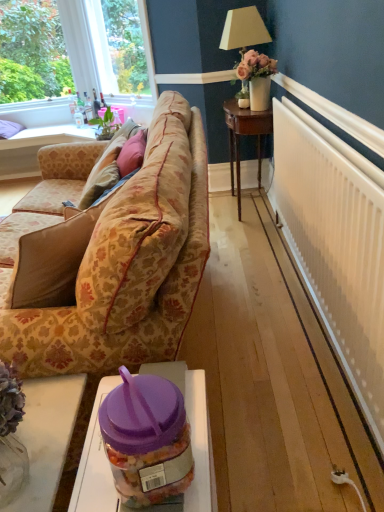
Question: Is velvet pink pillow at center to the right of clear glass window at upper left from the viewer's perspective?

Choices:
 (A) yes
 (B) no

Answer: (A)

Question: From a real-world perspective, is velvet pink pillow at center beneath clear glass window at upper left?

Choices:
 (A) yes
 (B) no

Answer: (A)

Question: Is clear glass window at upper left located within velvet pink pillow at center?

Choices:
 (A) no
 (B) yes

Answer: (A)

Question: Can you confirm if velvet pink pillow at center is smaller than clear glass window at upper left?

Choices:
 (A) yes
 (B) no

Answer: (A)

Question: From the image's perspective, does velvet pink pillow at center appear lower than clear glass window at upper left?

Choices:
 (A) no
 (B) yes

Answer: (B)

Question: Does velvet pink pillow at center have a lesser width compared to clear glass window at upper left?

Choices:
 (A) no
 (B) yes

Answer: (B)

Question: From a real-world perspective, is wooden coffee table at lower left, the third table from the bottom, under purple plastic jar at lower center, arranged as the 2th table when viewed from the top?

Choices:
 (A) no
 (B) yes

Answer: (B)

Question: Is wooden coffee table at lower left, marked as the 1th table in a left-to-right arrangement, smaller than purple plastic jar at lower center, the second table in the bottom-to-top sequence?

Choices:
 (A) no
 (B) yes

Answer: (A)

Question: Is purple plastic jar at lower center, arranged as the 2th table when viewed from the top, located within wooden coffee table at lower left, marked as the 1th table in a left-to-right arrangement?

Choices:
 (A) yes
 (B) no

Answer: (B)

Question: Is wooden coffee table at lower left, the third table positioned from the right, next to purple plastic jar at lower center, the second table in the bottom-to-top sequence?

Choices:
 (A) no
 (B) yes

Answer: (A)

Question: Is wooden coffee table at lower left, the 1th table viewed from the back, at the left side of purple plastic jar at lower center, arranged as the 2th table when viewed from the top?

Choices:
 (A) no
 (B) yes

Answer: (B)

Question: Does wooden coffee table at lower left, which is counted as the 1th table, starting from the top, have a greater width compared to purple plastic jar at lower center, positioned as the 1th table in right-to-left order?

Choices:
 (A) yes
 (B) no

Answer: (A)

Question: Can you confirm if clear glass window at upper left is shorter than velvet pink pillow at center?

Choices:
 (A) yes
 (B) no

Answer: (B)